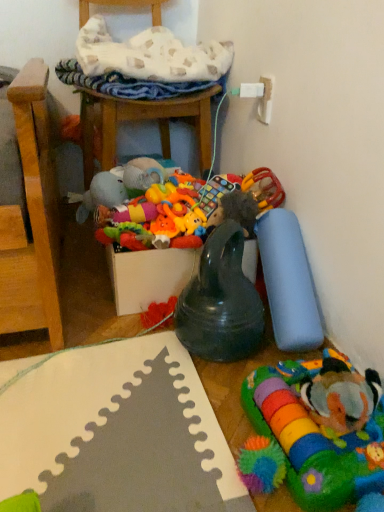
Image resolution: width=384 pixels, height=512 pixels. Find the location of `vacant area that is in front of rubberized black teething ring at center, the second toy from the left`. vacant area that is in front of rubberized black teething ring at center, the second toy from the left is located at coordinates (189, 410).